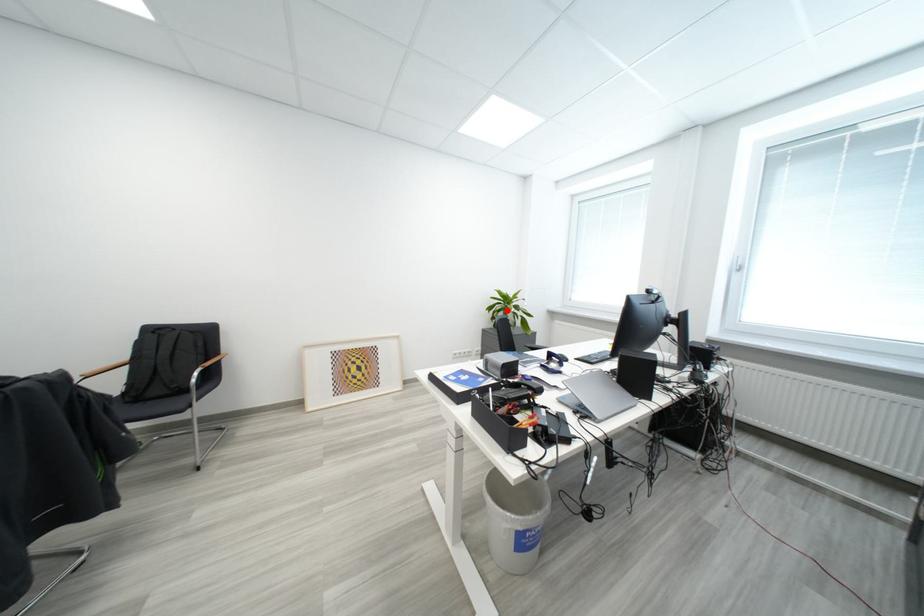
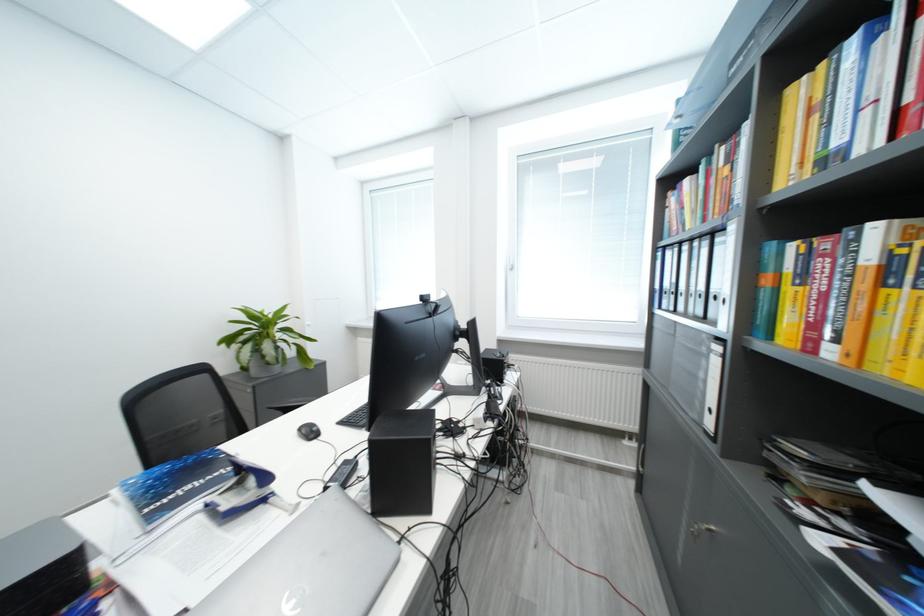
In the second image, find the point that corresponds to the highlighted location in the first image.

(251, 341)